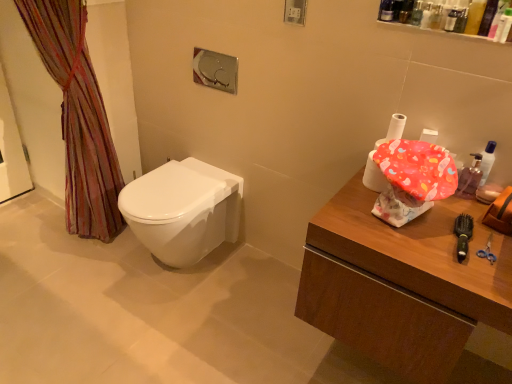
The width and height of the screenshot is (512, 384). Identify the location of free space behind green plastic brush at right. (451, 215).